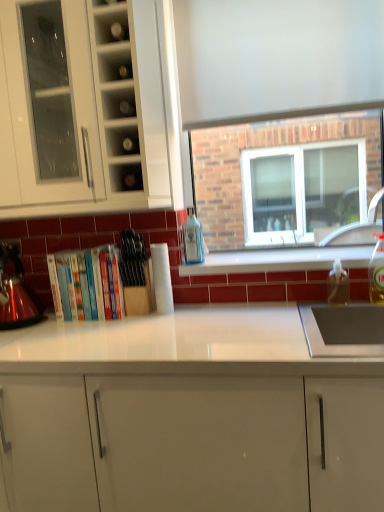
Describe the element at coordinates (192, 443) in the screenshot. I see `white glossy cabinet at center, placed as the 2th cabinetry when sorted from top to bottom` at that location.

The image size is (384, 512). In order to click on clear glass shelf at upper center, positioned as the 2th shelf in bottom-to-top order in this screenshot , I will do `click(122, 141)`.

This screenshot has height=512, width=384. What do you see at coordinates (338, 285) in the screenshot?
I see `translucent plastic bottle at right, which is the second bottle in left-to-right order` at bounding box center [338, 285].

I want to click on white paper towel at center, so click(162, 278).

Is matte glass shelf at upper center, placed as the 2th shelf when sorted from top to bottom, located outside white glossy window sill at center?

matte glass shelf at upper center, placed as the 2th shelf when sorted from top to bottom, is positioned outside white glossy window sill at center.

Does matte glass shelf at upper center, placed as the 2th shelf when sorted from top to bottom, turn towards white glossy window sill at center?

No, matte glass shelf at upper center, placed as the 2th shelf when sorted from top to bottom, is not aimed at white glossy window sill at center.

In the image, is matte glass shelf at upper center, the 1th shelf when ordered from bottom to top, on the left side or the right side of white glossy window sill at center?

matte glass shelf at upper center, the 1th shelf when ordered from bottom to top, is to the left of white glossy window sill at center.

Based on the photo, is shiny metallic kettle at left closer to camera compared to clear glass shelf at upper center, positioned as the 2th shelf in bottom-to-top order?

No.

Considering the positions of point (9, 311) and point (106, 132), is point (9, 311) closer or farther from the camera than point (106, 132)?

Point (9, 311) appears to be farther away from the viewer than point (106, 132).

Is shiny metallic kettle at left aimed at clear glass shelf at upper center, which ranks as the first shelf in top-to-bottom order?

No, shiny metallic kettle at left is not turned towards clear glass shelf at upper center, which ranks as the first shelf in top-to-bottom order.

Would you consider shiny metallic kettle at left to be distant from clear glass shelf at upper center, positioned as the 2th shelf in bottom-to-top order?

No, there isn't a large distance between shiny metallic kettle at left and clear glass shelf at upper center, positioned as the 2th shelf in bottom-to-top order.

From the picture: Could you tell me if clear glass shelf at upper center, positioned as the 2th shelf in bottom-to-top order, is turned towards clear plastic bottle at right, the first bottle from the front?

No, clear glass shelf at upper center, positioned as the 2th shelf in bottom-to-top order, is not turned towards clear plastic bottle at right, the first bottle from the front.

Considering the sizes of clear glass shelf at upper center, positioned as the 2th shelf in bottom-to-top order, and clear plastic bottle at right, acting as the first bottle starting from the right, in the image, is clear glass shelf at upper center, positioned as the 2th shelf in bottom-to-top order, bigger or smaller than clear plastic bottle at right, acting as the first bottle starting from the right,?

In the image, clear glass shelf at upper center, positioned as the 2th shelf in bottom-to-top order, appears to be smaller than clear plastic bottle at right, acting as the first bottle starting from the right.

Starting from the clear plastic bottle at right, acting as the first bottle starting from the right, which shelf is the 2nd one in front? Please provide its 2D coordinates.

[(122, 141)]

From the image's perspective, is blue glass bottle at center, marked as the 1th bottle in a left-to-right arrangement, positioned above or below white glossy cabinet at upper left, which is the first cabinetry from top to bottom?

From the image's perspective, blue glass bottle at center, marked as the 1th bottle in a left-to-right arrangement, appears below white glossy cabinet at upper left, which is the first cabinetry from top to bottom.

Is blue glass bottle at center, which is the 3th bottle in front-to-back order, smaller than white glossy cabinet at upper left, the 2th cabinetry positioned from the bottom?

Yes.

Which is correct: blue glass bottle at center, marked as the 1th bottle in a left-to-right arrangement, is inside white glossy cabinet at upper left, which is the first cabinetry from top to bottom, or outside of it?

blue glass bottle at center, marked as the 1th bottle in a left-to-right arrangement, is spatially situated outside white glossy cabinet at upper left, which is the first cabinetry from top to bottom.

From the picture: Is blue glass bottle at center, marked as the 1th bottle in a left-to-right arrangement, looking in the opposite direction of white glossy cabinet at upper left, the 2th cabinetry positioned from the bottom?

No, white glossy cabinet at upper left, the 2th cabinetry positioned from the bottom, is not at the back of blue glass bottle at center, marked as the 1th bottle in a left-to-right arrangement.

Which of these two, white glossy cabinet at center, placed as the 2th cabinetry when sorted from top to bottom, or hardcover books at center, is wider?

white glossy cabinet at center, placed as the 2th cabinetry when sorted from top to bottom, is wider.

In the scene shown: Between white glossy cabinet at center, placed as the 2th cabinetry when sorted from top to bottom, and hardcover books at center, which one appears on the left side from the viewer's perspective?

hardcover books at center is more to the left.

From a real-world perspective, is white glossy cabinet at center, arranged as the first cabinetry when ordered from the bottom, below hardcover books at center?

Yes, from a real-world perspective, white glossy cabinet at center, arranged as the first cabinetry when ordered from the bottom, is below hardcover books at center.

Can you tell me how much white glossy cabinet at center, arranged as the first cabinetry when ordered from the bottom, and hardcover books at center differ in facing direction?

The angular difference between white glossy cabinet at center, arranged as the first cabinetry when ordered from the bottom, and hardcover books at center is 0.00112 degrees.

Between white glossy cabinet at center, arranged as the first cabinetry when ordered from the bottom, and shiny metallic kettle at left, which one has less height?

Standing shorter between the two is shiny metallic kettle at left.

Considering the sizes of objects white glossy cabinet at center, arranged as the first cabinetry when ordered from the bottom, and shiny metallic kettle at left in the image provided, who is thinner, white glossy cabinet at center, arranged as the first cabinetry when ordered from the bottom, or shiny metallic kettle at left?

shiny metallic kettle at left.

Does white glossy cabinet at center, placed as the 2th cabinetry when sorted from top to bottom, turn towards shiny metallic kettle at left?

No.

From the image's perspective, would you say white glossy cabinet at center, arranged as the first cabinetry when ordered from the bottom, is positioned over shiny metallic kettle at left?

No.

From the image's perspective, is white glossy cabinet at upper left, which is the first cabinetry from top to bottom, over clear plastic bottle at right, the first bottle from the front?

Indeed, from the image's perspective, white glossy cabinet at upper left, which is the first cabinetry from top to bottom, is shown above clear plastic bottle at right, the first bottle from the front.

Can clear plastic bottle at right, the first bottle from the front, be found inside white glossy cabinet at upper left, which is the first cabinetry from top to bottom?

No, clear plastic bottle at right, the first bottle from the front, is not surrounded by white glossy cabinet at upper left, which is the first cabinetry from top to bottom.

Between white glossy cabinet at upper left, the 2th cabinetry positioned from the bottom, and clear plastic bottle at right, the first bottle from the front, which one has smaller size?

Smaller between the two is clear plastic bottle at right, the first bottle from the front.

Considering the relative positions of white glossy cabinet at upper left, which is the first cabinetry from top to bottom, and clear plastic bottle at right, the third bottle in the left-to-right sequence, in the image provided, is white glossy cabinet at upper left, which is the first cabinetry from top to bottom, in front of clear plastic bottle at right, the third bottle in the left-to-right sequence,?

Yes, it is.

Which shelf is the 1st one when counting from the left side of the white glossy window sill at center? Please provide its 2D coordinates.

[(126, 177)]

This screenshot has height=512, width=384. What are the coordinates of `kitchen appliance below the clear glass shelf at upper center, positioned as the 2th shelf in bottom-to-top order (from the image's perspective)` in the screenshot? It's located at (16, 291).

Based on their spatial positions, is white glossy window sill at center or white paper towel at center further from hardcover books at center?

Among the two, white glossy window sill at center is located further to hardcover books at center.

Estimate the real-world distances between objects in this image. Which object is closer to shiny metallic kettle at left, white paper towel at center or white glossy window sill at center?

white paper towel at center is positioned closer to the anchor shiny metallic kettle at left.

Considering their positions, is matte glass shelf at upper center, the 1th shelf when ordered from bottom to top, positioned closer to white glossy cabinet at center, placed as the 2th cabinetry when sorted from top to bottom, than white glossy window sill at center?

Based on the image, white glossy window sill at center appears to be nearer to white glossy cabinet at center, placed as the 2th cabinetry when sorted from top to bottom.

Looking at the image, which one is located further to hardcover books at center, clear glass shelf at upper center, which ranks as the first shelf in top-to-bottom order, or white glossy cabinet at center, arranged as the first cabinetry when ordered from the bottom?

Based on the image, white glossy cabinet at center, arranged as the first cabinetry when ordered from the bottom, appears to be further to hardcover books at center.

Based on their spatial positions, is white glossy window sill at center or white glossy cabinet at center, placed as the 2th cabinetry when sorted from top to bottom, closer to hardcover books at center?

white glossy window sill at center is closer to hardcover books at center.

Based on their spatial positions, is translucent plastic bottle at right, which is counted as the 2th bottle, starting from the right, or blue glass bottle at center, placed as the 1th bottle when sorted from back to front, closer to clear glass shelf at upper center, which ranks as the first shelf in top-to-bottom order?

blue glass bottle at center, placed as the 1th bottle when sorted from back to front, is positioned closer to the anchor clear glass shelf at upper center, which ranks as the first shelf in top-to-bottom order.

Based on their spatial positions, is clear glass shelf at upper center, which ranks as the first shelf in top-to-bottom order, or shiny metallic kettle at left further from hardcover books at center?

Based on the image, clear glass shelf at upper center, which ranks as the first shelf in top-to-bottom order, appears to be further to hardcover books at center.

Based on their spatial positions, is white paper towel at center or blue glass bottle at center, acting as the third bottle starting from the right, further from hardcover books at center?

blue glass bottle at center, acting as the third bottle starting from the right, lies further to hardcover books at center than the other object.

The image size is (384, 512). In order to click on cabinetry between hardcover books at center and white glossy window sill at center in the horizontal direction in this screenshot , I will do `click(192, 443)`.

Where is `window sill between clear glass shelf at upper center, which ranks as the first shelf in top-to-bottom order, and white glossy cabinet at center, placed as the 2th cabinetry when sorted from top to bottom, vertically`? The image size is (384, 512). window sill between clear glass shelf at upper center, which ranks as the first shelf in top-to-bottom order, and white glossy cabinet at center, placed as the 2th cabinetry when sorted from top to bottom, vertically is located at coordinates (280, 260).

Find the location of a particular element. This screenshot has height=512, width=384. bottle between white glossy cabinet at upper left, the 2th cabinetry positioned from the bottom, and translucent plastic bottle at right, the second bottle when ordered from front to back, in the horizontal direction is located at coordinates (193, 239).

Where is `shelf between clear glass shelf at upper center, positioned as the 2th shelf in bottom-to-top order, and white glossy cabinet at center, arranged as the first cabinetry when ordered from the bottom, from top to bottom`? The height and width of the screenshot is (512, 384). shelf between clear glass shelf at upper center, positioned as the 2th shelf in bottom-to-top order, and white glossy cabinet at center, arranged as the first cabinetry when ordered from the bottom, from top to bottom is located at coordinates (126, 177).